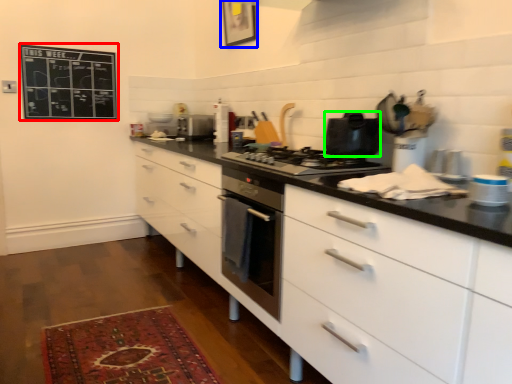
Question: Which is nearer to the bulletin board (highlighted by a red box)? picture frame (highlighted by a blue box) or kitchen appliance (highlighted by a green box).

Choices:
 (A) picture frame
 (B) kitchen appliance

Answer: (A)